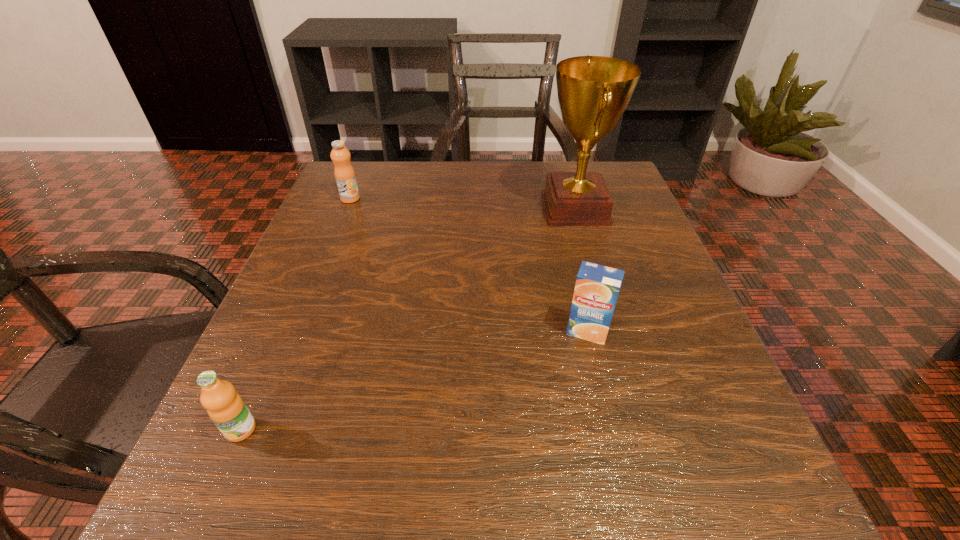
The width and height of the screenshot is (960, 540). Identify the location of unoccupied area between the tallest object and the farthest orange juice. (463, 204).

At what (x,y) coordinates should I click in order to perform the action: click on free area in between the award and the farthest orange juice. Please return your answer as a coordinate pair (x, y). Image resolution: width=960 pixels, height=540 pixels. Looking at the image, I should click on (463, 204).

Locate an element on the screen. The width and height of the screenshot is (960, 540). vacant area that lies between the second nearest object and the farthest orange juice is located at coordinates (468, 265).

Choose which object is the second nearest neighbor to the nearest object. Please provide its 2D coordinates. Your answer should be formatted as a tuple, i.e. [(x, y)], where the tuple contains the x and y coordinates of a point satisfying the conditions above.

[(344, 173)]

Identify which object is located as the nearest to the nearest orange juice. Please provide its 2D coordinates. Your answer should be formatted as a tuple, i.e. [(x, y)], where the tuple contains the x and y coordinates of a point satisfying the conditions above.

[(597, 286)]

Locate an element on the screen. The height and width of the screenshot is (540, 960). orange juice that is the second closest to the nearest orange juice is located at coordinates (344, 173).

Select which orange juice appears as the closest to the rightmost orange juice. Please provide its 2D coordinates. Your answer should be formatted as a tuple, i.e. [(x, y)], where the tuple contains the x and y coordinates of a point satisfying the conditions above.

[(226, 408)]

This screenshot has width=960, height=540. Identify the location of vacant area in the image that satisfies the following two spatial constraints: 1. on the front label of the rightmost orange juice; 2. on the left side of the farthest orange juice. (297, 331).